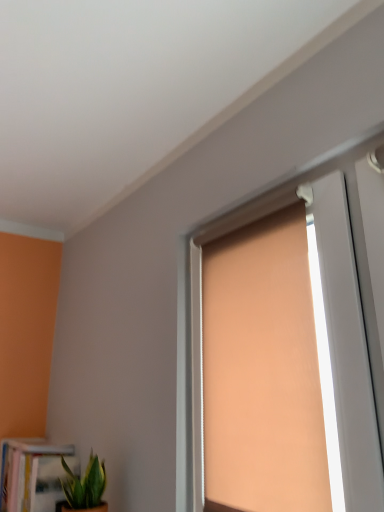
Question: Is white glossy bookcase at lower left at the right side of matte orange roller blind at center?

Choices:
 (A) yes
 (B) no

Answer: (B)

Question: From a real-world perspective, is white glossy bookcase at lower left positioned over matte orange roller blind at center based on gravity?

Choices:
 (A) no
 (B) yes

Answer: (A)

Question: Can you confirm if white glossy bookcase at lower left is taller than matte orange roller blind at center?

Choices:
 (A) yes
 (B) no

Answer: (B)

Question: Is white glossy bookcase at lower left turned away from matte orange roller blind at center?

Choices:
 (A) no
 (B) yes

Answer: (A)

Question: Can you confirm if white glossy bookcase at lower left is shorter than matte orange roller blind at center?

Choices:
 (A) yes
 (B) no

Answer: (A)

Question: Can you confirm if white glossy bookcase at lower left is positioned to the left of matte orange roller blind at center?

Choices:
 (A) no
 (B) yes

Answer: (B)

Question: Does green leafy plant at lower left have a lesser height compared to matte orange roller blind at center?

Choices:
 (A) no
 (B) yes

Answer: (B)

Question: Does green leafy plant at lower left have a larger size compared to matte orange roller blind at center?

Choices:
 (A) no
 (B) yes

Answer: (A)

Question: Can you see green leafy plant at lower left touching matte orange roller blind at center?

Choices:
 (A) no
 (B) yes

Answer: (A)

Question: Could you tell me if green leafy plant at lower left is turned towards matte orange roller blind at center?

Choices:
 (A) yes
 (B) no

Answer: (B)

Question: From a real-world perspective, is green leafy plant at lower left located higher than matte orange roller blind at center?

Choices:
 (A) yes
 (B) no

Answer: (B)

Question: Considering the relative positions of green leafy plant at lower left and matte orange roller blind at center in the image provided, is green leafy plant at lower left to the right of matte orange roller blind at center from the viewer's perspective?

Choices:
 (A) no
 (B) yes

Answer: (A)

Question: Is green leafy plant at lower left beside white glossy bookcase at lower left?

Choices:
 (A) yes
 (B) no

Answer: (B)